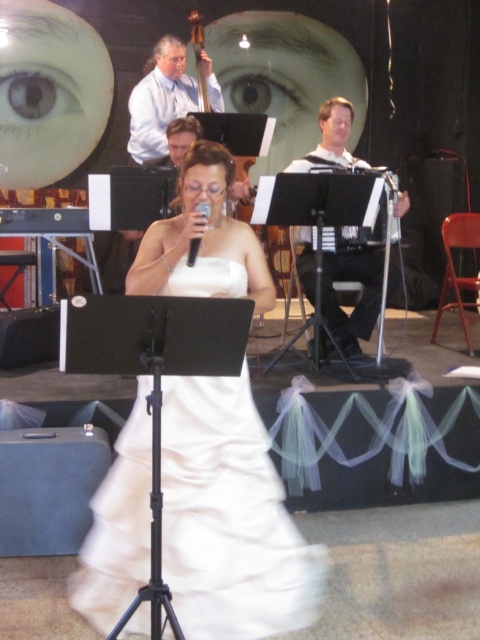
Question: Can you confirm if light blue shirt at upper center is positioned above black plastic microphone at center?

Choices:
 (A) yes
 (B) no

Answer: (A)

Question: Which point is farther to the camera?

Choices:
 (A) (193, 243)
 (B) (107, 577)
 (C) (6, 113)
 (D) (162, 44)

Answer: (C)

Question: Among these objects, which one is nearest to the camera?

Choices:
 (A) white satin dress at center
 (B) light blue shirt at upper center
 (C) brown matte eye at upper left
 (D) white fabric dress at center

Answer: (A)

Question: Can you confirm if white fabric dress at center is thinner than brown matte eye at upper left?

Choices:
 (A) yes
 (B) no

Answer: (A)

Question: Estimate the real-world distances between objects in this image. Which object is farther from the white fabric dress at center?

Choices:
 (A) black plastic microphone at center
 (B) white satin dress at center

Answer: (B)

Question: Does light blue shirt at upper center appear over black plastic microphone at center?

Choices:
 (A) no
 (B) yes

Answer: (B)